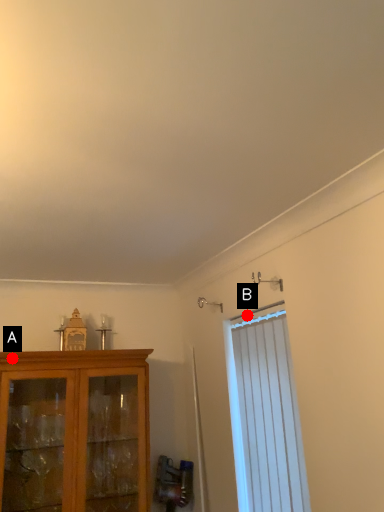
Question: Two points are circled on the image, labeled by A and B beside each circle. Which of the following is the closest to the observer?

Choices:
 (A) A is closer
 (B) B is closer

Answer: (A)